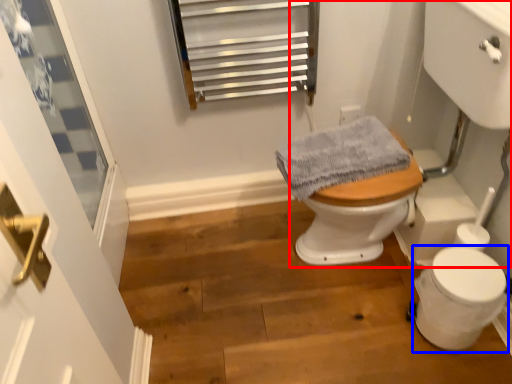
Question: Which point is further to the camera, sink (highlighted by a red box) or toilet bowl (highlighted by a blue box)?

Choices:
 (A) sink
 (B) toilet bowl

Answer: (B)